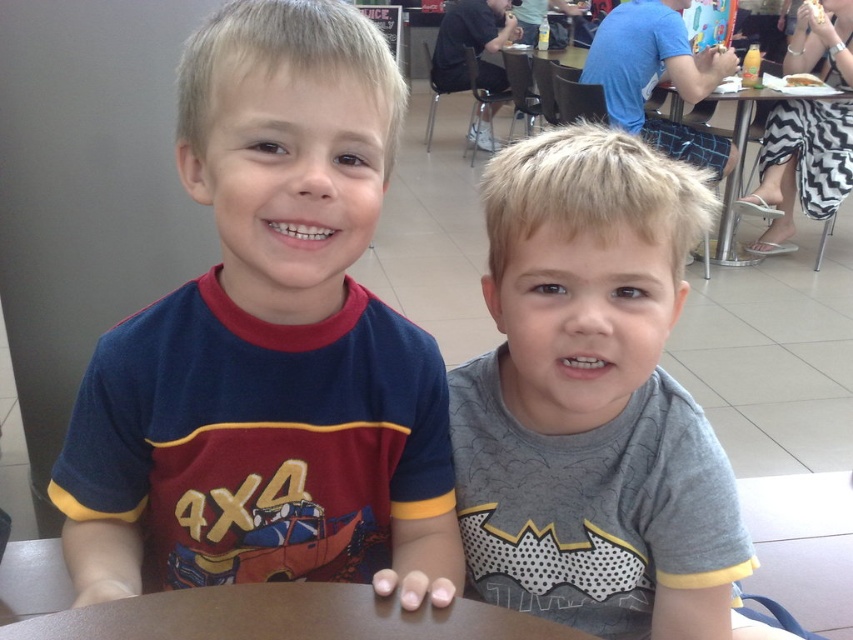
You are a photographer setting up a shoot in the dining area. You need to decide which clothing item takes up more visual space in the frame between the gray cotton shirt at center and the black and white zigzag dress at right. Which one should you focus on for a balanced composition?

The black and white zigzag dress at right occupies more visual space than the gray cotton shirt at center, so focusing on it would help achieve a balanced composition.

You are a photographer setting up for a photo shoot in the dining area. You need to ensure that the maroon fabric shirt at center is visible in the shot. Given that the metallic silver table at center is in the way, should you adjust the angle to look above or below the table to capture the shirt?

The maroon fabric shirt at center is positioned under the metallic silver table at center, so to capture the shirt while avoiding the table blocking it, you should adjust the angle to look below the table.

You are a photographer trying to capture a candid shot of the two boys. You notice the maroon fabric shirt at center and the metallic silver table at center. Which object should you focus on first if you want to photograph the boy on the left?

The maroon fabric shirt at center is to the left of the metallic silver table at center, so to photograph the boy on the left, you should focus on the maroon fabric shirt at center first since it is positioned closer to his location.